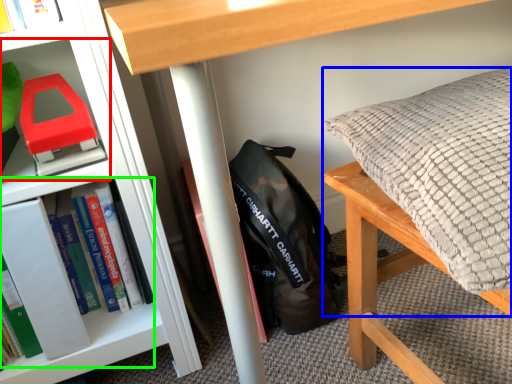
Question: Estimate the real-world distances between objects in this image. Which object is farther from shelf (highlighted by a red box), pillow (highlighted by a blue box) or book (highlighted by a green box)?

Choices:
 (A) pillow
 (B) book

Answer: (A)